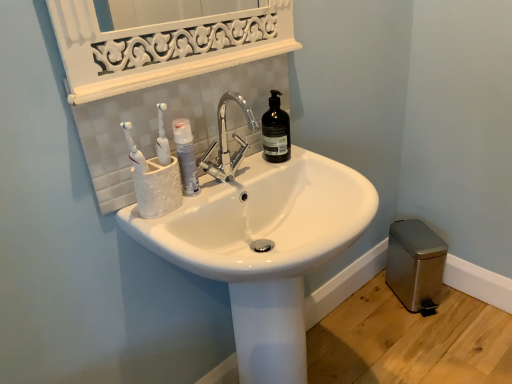
Question: Is point (181, 144) positioned closer to the camera than point (268, 129)?

Choices:
 (A) farther
 (B) closer

Answer: (B)

Question: Would you say white glossy mouthwash at center is to the left or to the right of black matte bottle at upper center in the picture?

Choices:
 (A) right
 (B) left

Answer: (B)

Question: Which object is positioned closest to the metallic gray trash can at lower right?

Choices:
 (A) black matte bottle at upper center
 (B) white glossy mouthwash at center
 (C) white glossy sink at center

Answer: (C)

Question: Which of these objects is positioned closest to the metallic gray trash can at lower right?

Choices:
 (A) white glossy sink at center
 (B) black matte bottle at upper center
 (C) white glossy mouthwash at center

Answer: (A)